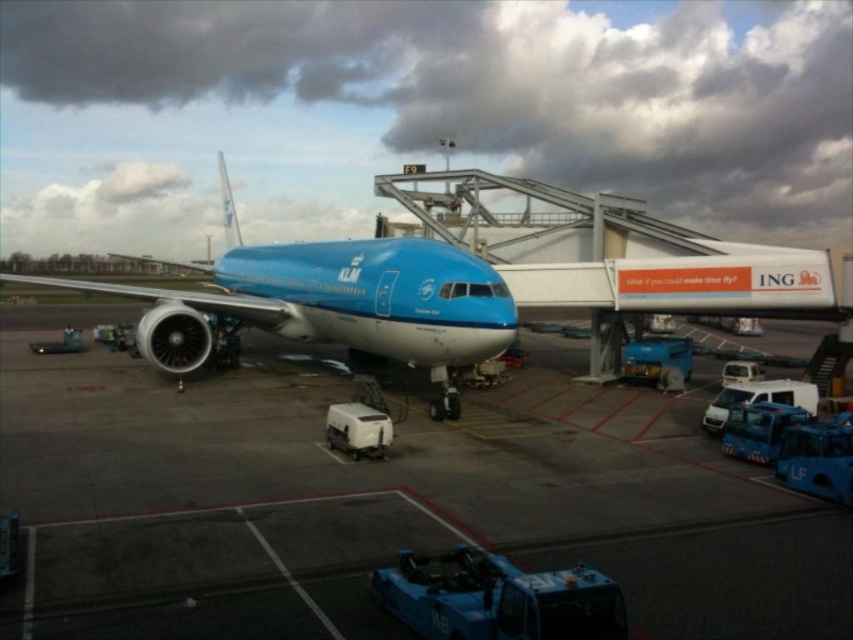
Does matte white tarmac at center have a greater width compared to matte blue airplane at center?

No, matte white tarmac at center is not wider than matte blue airplane at center.

Does point (399, 499) come behind point (180, 300)?

No, it is not.

Who is more distant from viewer, (556, 483) or (384, 310)?

The point (384, 310) is behind.

Where is `matte white tarmac at center`? This screenshot has width=853, height=640. matte white tarmac at center is located at coordinates (381, 500).